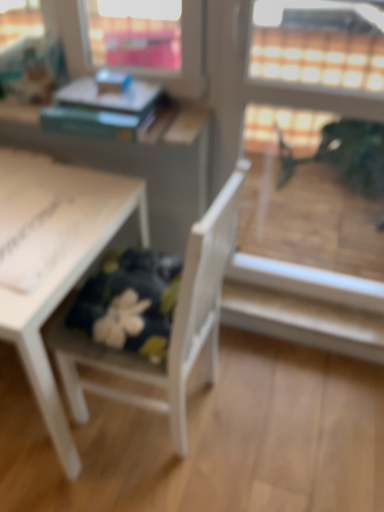
Where is `hardcover book at upper left`? Image resolution: width=384 pixels, height=512 pixels. hardcover book at upper left is located at coordinates (101, 109).

What do you see at coordinates (101, 109) in the screenshot? I see `hardcover book at upper left` at bounding box center [101, 109].

This screenshot has height=512, width=384. Identify the location of transparent glass screen door at upper right. (257, 86).

What are the coordinates of `hardcover book at upper left` in the screenshot? It's located at (101, 109).

Which object is more forward, white wood chair at lower left or hardcover book at upper left?

white wood chair at lower left is in front.

Is white wood chair at lower left to the right of hardcover book at upper left from the viewer's perspective?

Yes.

Locate an element on the screen. The image size is (384, 512). chair on the right of hardcover book at upper left is located at coordinates (172, 324).

From a real-world perspective, which is physically below, white wood chair at lower left or hardcover book at upper left?

white wood chair at lower left, from a real-world perspective.

Is white wood chair at lower left oriented towards white matte table at lower left?

Yes, white wood chair at lower left is aimed at white matte table at lower left.

Is point (191, 327) farther from camera compared to point (19, 323)?

Yes, point (191, 327) is behind point (19, 323).

From the image's perspective, would you say white wood chair at lower left is positioned over white matte table at lower left?

No, from the image's perspective, white wood chair at lower left is not over white matte table at lower left.

Is there a large distance between white wood chair at lower left and white matte table at lower left?

white wood chair at lower left is near white matte table at lower left, not far away.

Could you tell me if hardcover book at upper left is turned towards white matte table at lower left?

No, hardcover book at upper left does not turn towards white matte table at lower left.

Is hardcover book at upper left placed right next to white matte table at lower left?

hardcover book at upper left and white matte table at lower left are clearly separated.

From a real-world perspective, is hardcover book at upper left below white matte table at lower left?

Incorrect, from a real-world perspective, hardcover book at upper left is higher than white matte table at lower left.

Does hardcover book at upper left have a lesser height compared to white wood chair at lower left?

Correct, hardcover book at upper left is not as tall as white wood chair at lower left.

Which is more to the right, hardcover book at upper left or white wood chair at lower left?

white wood chair at lower left is more to the right.

Considering the positions of point (141, 118) and point (197, 261), is point (141, 118) closer or farther from the camera than point (197, 261)?

Point (141, 118) appears to be farther away from the viewer than point (197, 261).

Based on the photo, from a real-world perspective, is hardcover book at upper left physically below white wood chair at lower left?

No, from a real-world perspective, hardcover book at upper left is not under white wood chair at lower left.

Which is farther, [317,284] or [70,476]?

The point [317,284] is more distant.

What's the angular difference between transparent glass screen door at upper right and white matte table at lower left's facing directions?

A: transparent glass screen door at upper right and white matte table at lower left are facing 0.436 degrees away from each other.

Would you say transparent glass screen door at upper right is outside white matte table at lower left?

Yes, transparent glass screen door at upper right is located beyond the bounds of white matte table at lower left.

Is transparent glass screen door at upper right far from white matte table at lower left?

They are positioned close to each other.

From a real-world perspective, between white matte table at lower left and hardcover book at upper left, who is vertically higher?

In real-world perspective, hardcover book at upper left is above.

Considering the sizes of white matte table at lower left and hardcover book at upper left in the image, is white matte table at lower left wider or thinner than hardcover book at upper left?

Considering their sizes, white matte table at lower left looks broader than hardcover book at upper left.

Could you tell me if white matte table at lower left is turned towards hardcover book at upper left?

No, white matte table at lower left is not aimed at hardcover book at upper left.

This screenshot has height=512, width=384. In order to click on book behind the white matte table at lower left in this screenshot , I will do `click(101, 109)`.

Which is correct: white matte table at lower left is inside transparent glass screen door at upper right, or outside of it?

white matte table at lower left lies outside transparent glass screen door at upper right.

Where is `table below the transparent glass screen door at upper right (from the image's perspective)`? table below the transparent glass screen door at upper right (from the image's perspective) is located at coordinates (56, 257).

Could you tell me if white matte table at lower left is turned towards transparent glass screen door at upper right?

No, white matte table at lower left does not turn towards transparent glass screen door at upper right.

Considering the positions of objects white matte table at lower left and transparent glass screen door at upper right in the image provided, who is more to the right, white matte table at lower left or transparent glass screen door at upper right?

Positioned to the right is transparent glass screen door at upper right.

Locate an element on the screen. The image size is (384, 512). book that is behind the white wood chair at lower left is located at coordinates (x=101, y=109).

Find the location of a particular element. This screenshot has width=384, height=512. chair in front of the white matte table at lower left is located at coordinates (172, 324).

When comparing their distances from hardcover book at upper left, does white wood chair at lower left or white matte table at lower left seem closer?

white matte table at lower left is positioned closer to the anchor hardcover book at upper left.

When comparing their distances from white wood chair at lower left, does hardcover book at upper left or white matte table at lower left seem further?

hardcover book at upper left is positioned further to the anchor white wood chair at lower left.

When comparing their distances from hardcover book at upper left, does white wood chair at lower left or transparent glass screen door at upper right seem closer?

transparent glass screen door at upper right is closer to hardcover book at upper left.

When comparing their distances from hardcover book at upper left, does transparent glass screen door at upper right or white matte table at lower left seem further?

Among the two, transparent glass screen door at upper right is located further to hardcover book at upper left.

From the image, which object appears to be farther from white matte table at lower left, hardcover book at upper left or white wood chair at lower left?

white wood chair at lower left.

Looking at the image, which one is located closer to white wood chair at lower left, white matte table at lower left or hardcover book at upper left?

white matte table at lower left lies closer to white wood chair at lower left than the other object.

Based on their spatial positions, is hardcover book at upper left or transparent glass screen door at upper right closer to white matte table at lower left?

hardcover book at upper left lies closer to white matte table at lower left than the other object.

Based on their spatial positions, is white matte table at lower left or white wood chair at lower left further from hardcover book at upper left?

Among the two, white wood chair at lower left is located further to hardcover book at upper left.

This screenshot has height=512, width=384. I want to click on table between hardcover book at upper left and white wood chair at lower left in the vertical direction, so click(56, 257).

The height and width of the screenshot is (512, 384). In order to click on book between white matte table at lower left and transparent glass screen door at upper right from left to right in this screenshot , I will do `click(101, 109)`.

At what (x,y) coordinates should I click in order to perform the action: click on chair between white matte table at lower left and transparent glass screen door at upper right from left to right. Please return your answer as a coordinate pair (x, y). Looking at the image, I should click on (172, 324).

I want to click on chair between hardcover book at upper left and transparent glass screen door at upper right, so click(172, 324).